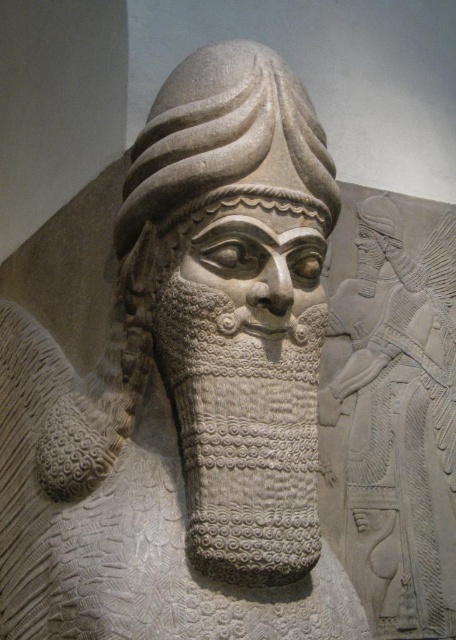
Question: Does gray stone head at center have a lesser width compared to gray stone head at upper right?

Choices:
 (A) no
 (B) yes

Answer: (A)

Question: Which object is closer to the camera taking this photo?

Choices:
 (A) gray stone head at center
 (B) gray stone head at upper right

Answer: (A)

Question: Does gray stone head at center appear under gray stone head at upper right?

Choices:
 (A) yes
 (B) no

Answer: (B)

Question: Can you confirm if gray stone head at center is positioned to the right of gray stone head at upper right?

Choices:
 (A) yes
 (B) no

Answer: (B)

Question: Which point appears farthest from the camera in this image?

Choices:
 (A) (377, 252)
 (B) (300, 99)

Answer: (A)

Question: Which point is farther to the camera?

Choices:
 (A) (298, 198)
 (B) (369, 260)

Answer: (B)